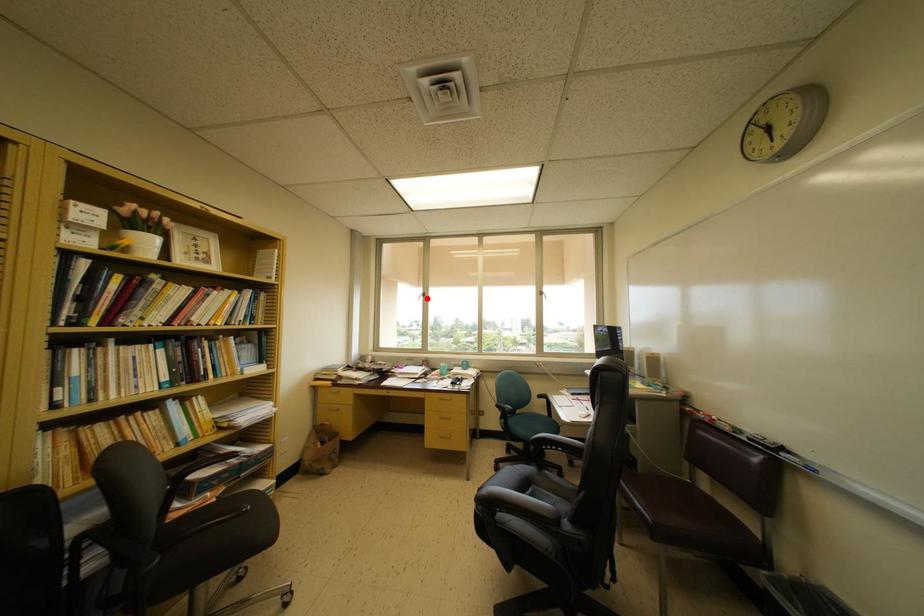
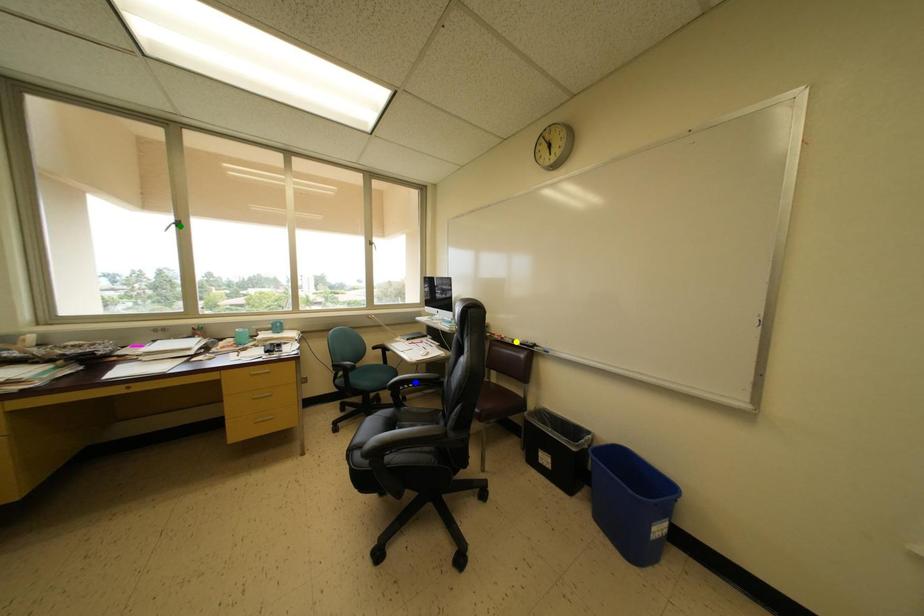
Question: I am providing you with two images of the same scene from different viewpoints. A red point is marked on the first image. You are given multiple points on the second image. Which mark in image 2 goes with the point in image 1?

Choices:
 (A) green point
 (B) yellow point
 (C) blue point

Answer: (A)